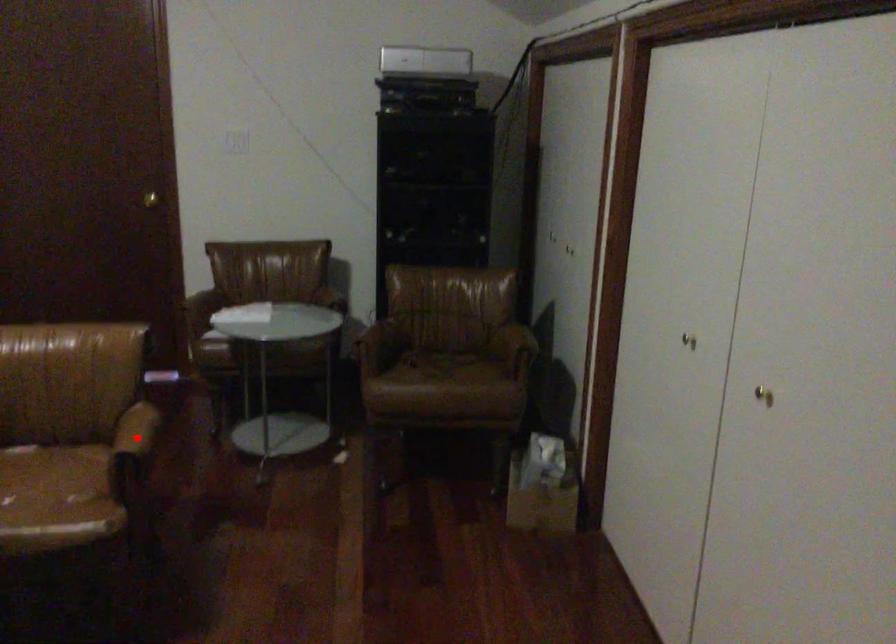
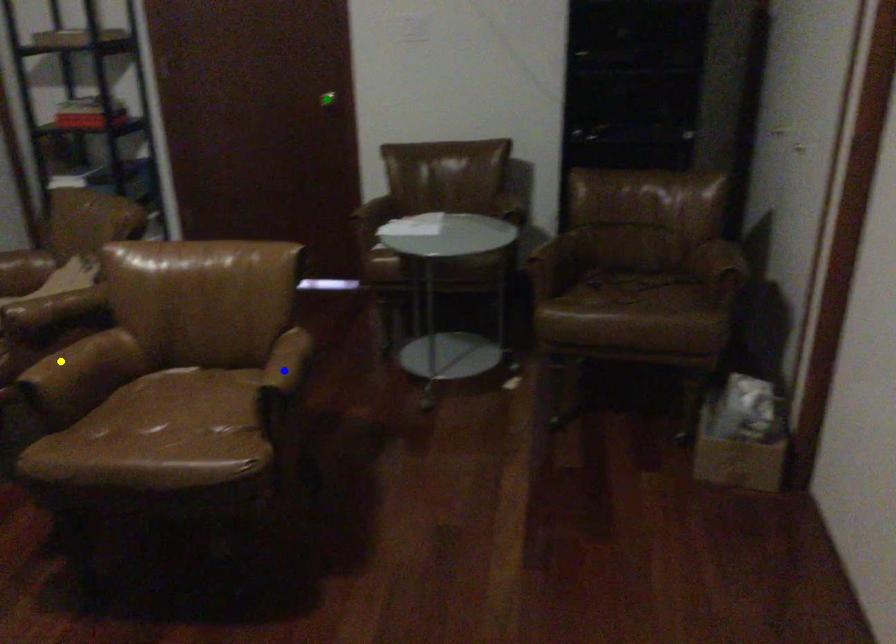
Question: I am providing you with two images of the same scene from different viewpoints. A red point is marked on the first image. You are given multiple points on the second image. Which point in image 2 represents the same 3d spot as the red point in image 1?

Choices:
 (A) blue point
 (B) green point
 (C) yellow point

Answer: (A)